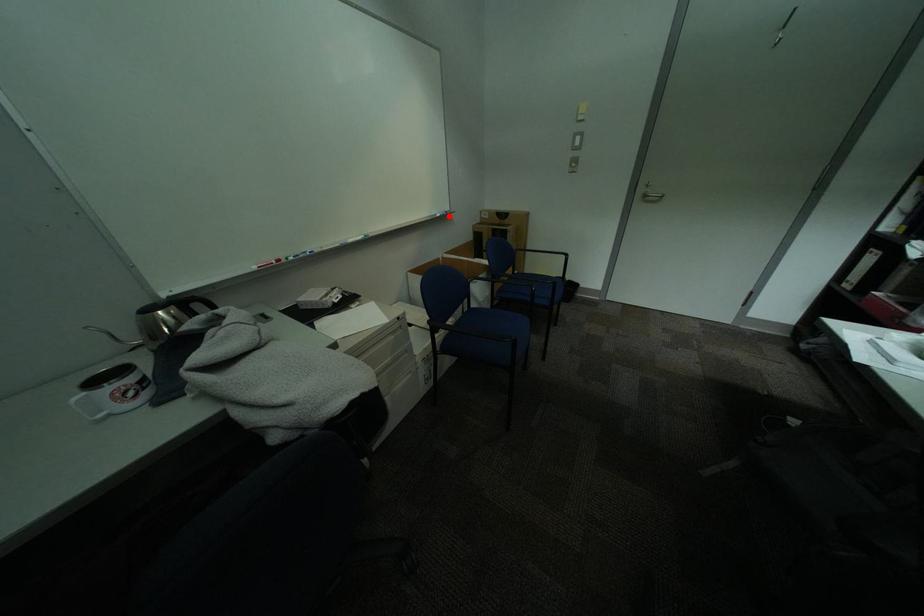
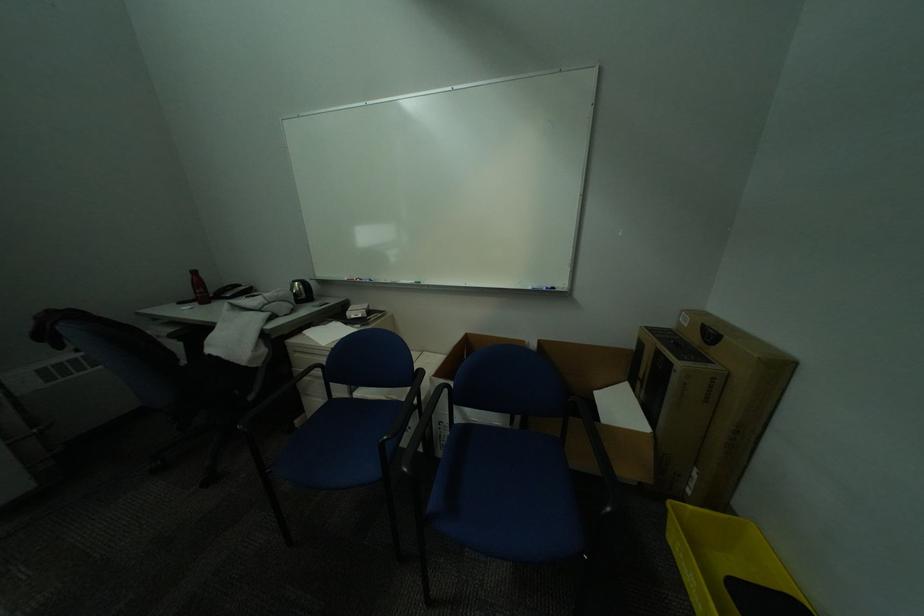
Question: I am providing you with two images of the same scene from different viewpoints. Image1 has a red point marked. In image2, the corresponding 3D location appears at what relative position? Reply with the corresponding letter.

Choices:
 (A) Closer
 (B) Farther

Answer: (B)